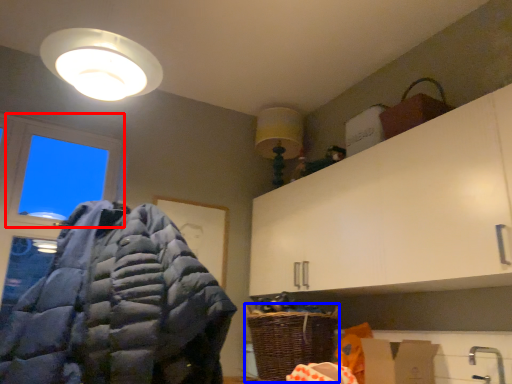
Question: Among these objects, which one is farthest to the camera, window (highlighted by a red box) or basket (highlighted by a blue box)?

Choices:
 (A) window
 (B) basket

Answer: (A)